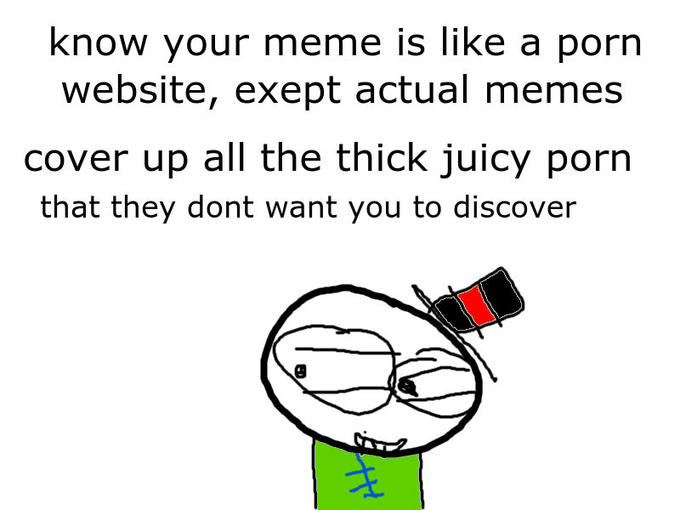
In order to click on chest in this screenshot , I will do `click(383, 474)`.